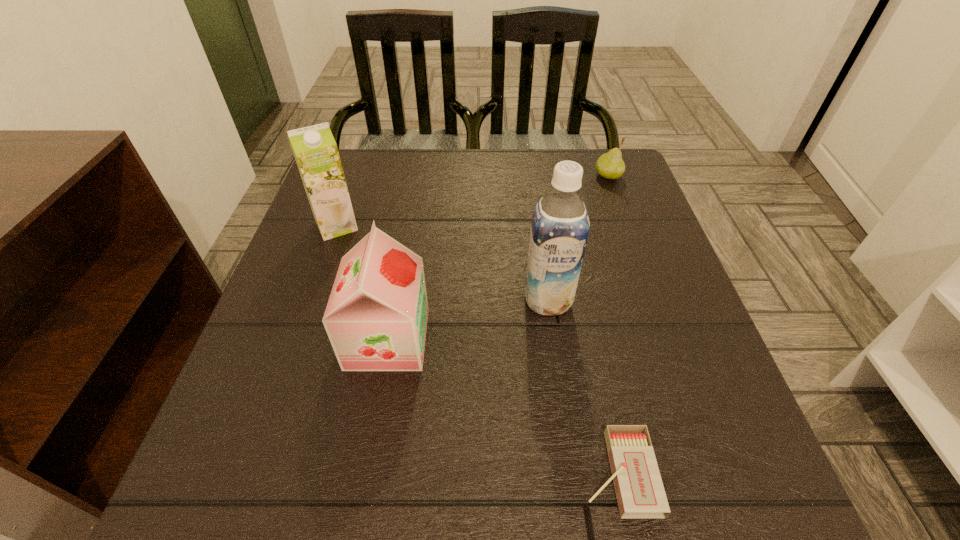
Find the location of `vacant space that's between the nearest object and the second soya milk from left to right`. vacant space that's between the nearest object and the second soya milk from left to right is located at coordinates (503, 406).

This screenshot has height=540, width=960. I want to click on free space between the fourth object from right to left and the pear, so click(498, 257).

This screenshot has width=960, height=540. I want to click on free point between the tallest soya milk and the shortest object, so click(583, 386).

Where is `free space between the shortest object and the farthest object`? Image resolution: width=960 pixels, height=540 pixels. free space between the shortest object and the farthest object is located at coordinates (613, 324).

Locate which object ranks third in proximity to the leftmost object. Please provide its 2D coordinates. Your answer should be formatted as a tuple, i.e. [(x, y)], where the tuple contains the x and y coordinates of a point satisfying the conditions above.

[(610, 165)]

The width and height of the screenshot is (960, 540). I want to click on the third closest object to the second object from left to right, so click(x=640, y=493).

Where is `soya milk object that ranks as the closest to the matchbox`? soya milk object that ranks as the closest to the matchbox is located at coordinates (560, 225).

This screenshot has height=540, width=960. In order to click on the second closest soya milk to the pear in this screenshot , I will do `click(376, 317)`.